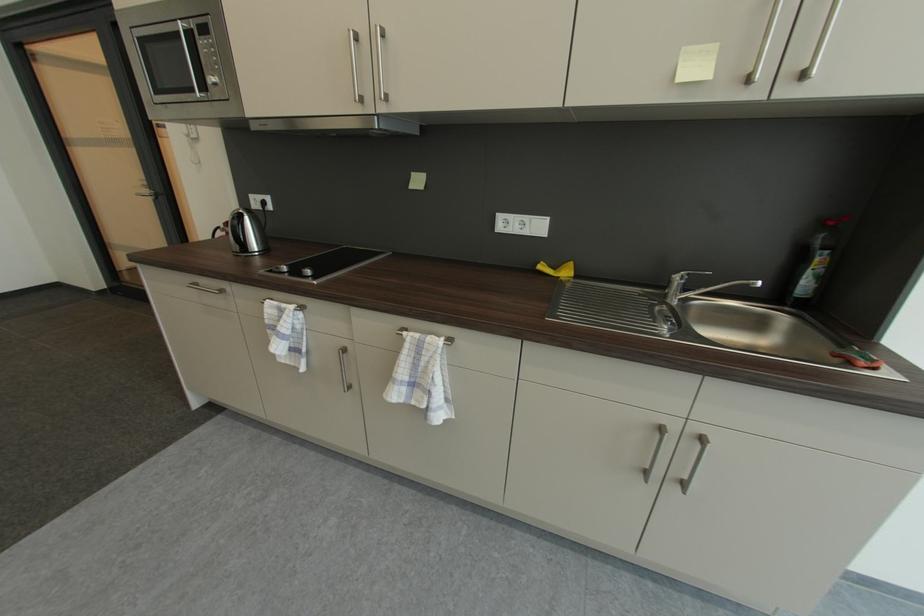
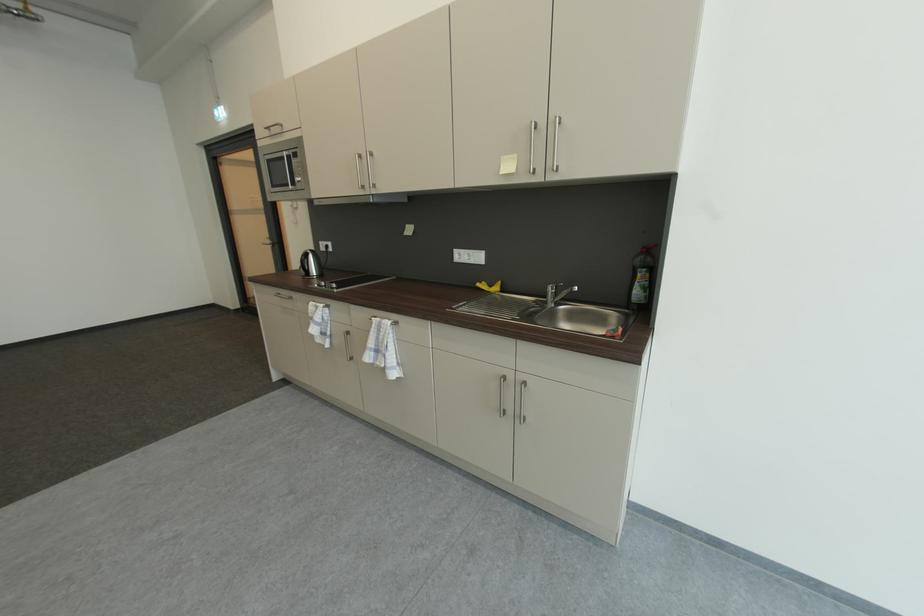
Locate, in the second image, the point that corresponds to the point at 670,298 in the first image.

(553, 304)